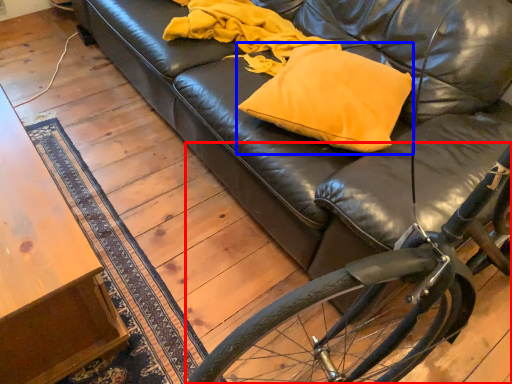
Question: Among these objects, which one is nearest to the camera, bicycle (highlighted by a red box) or throw pillow (highlighted by a blue box)?

Choices:
 (A) bicycle
 (B) throw pillow

Answer: (A)